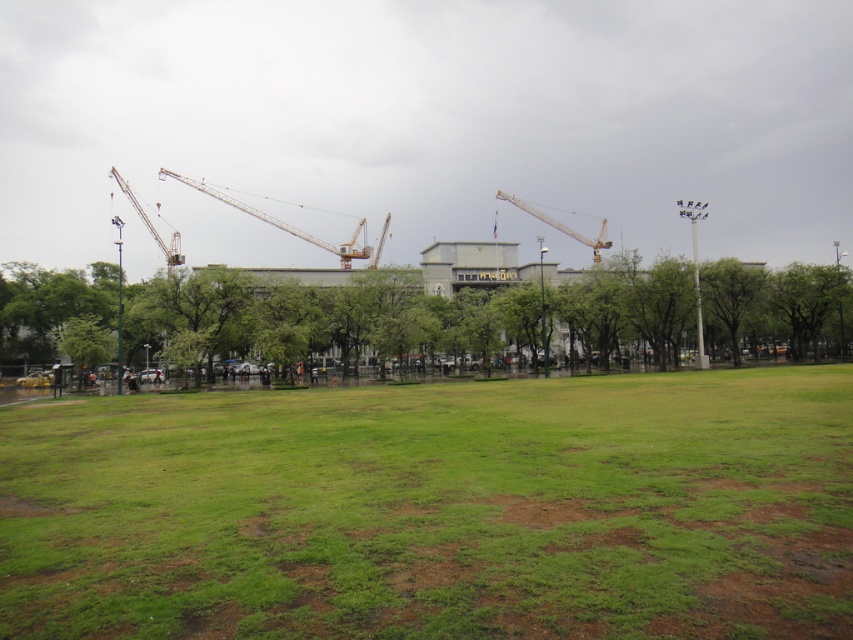
Question: Which object is closer to the camera taking this photo?

Choices:
 (A) green grassy field at center
 (B) green leafy tree at center

Answer: (A)

Question: Is green leafy tree at center below metallic yellow crane at left?

Choices:
 (A) no
 (B) yes

Answer: (B)

Question: Does green grassy field at center appear on the left side of metallic yellow crane at center?

Choices:
 (A) yes
 (B) no

Answer: (A)

Question: Does green grassy field at center have a lesser width compared to green leafy tree at center?

Choices:
 (A) yes
 (B) no

Answer: (A)

Question: Estimate the real-world distances between objects in this image. Which object is closer to the green leafy tree at center?

Choices:
 (A) yellow metallic crane at center
 (B) metallic yellow crane at center
 (C) metallic yellow crane at left
 (D) green grassy field at center

Answer: (C)

Question: Which of the following is the closest to the observer?

Choices:
 (A) green grassy field at center
 (B) green leafy tree at center
 (C) yellow metallic crane at center

Answer: (A)